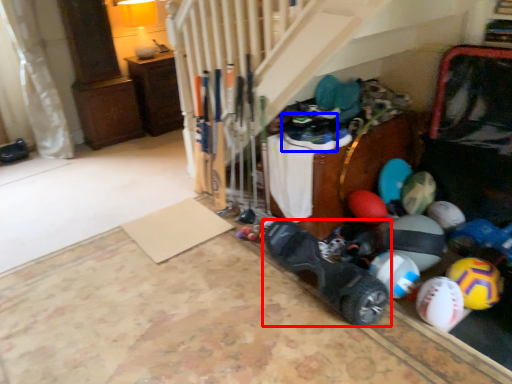
Question: Among these objects, which one is farthest to the camera, footwear (highlighted by a red box) or footwear (highlighted by a blue box)?

Choices:
 (A) footwear
 (B) footwear

Answer: (B)